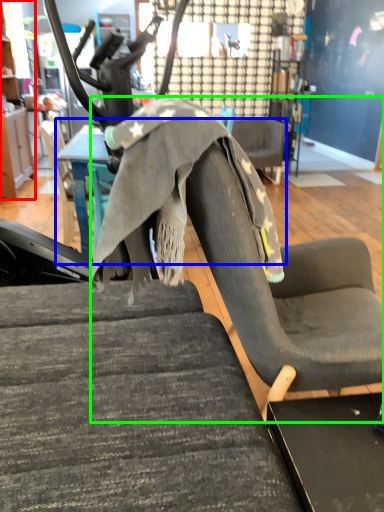
Question: Which is nearer to the cabinetry (highlighted by a red box)? table (highlighted by a blue box) or swivel chair (highlighted by a green box).

Choices:
 (A) table
 (B) swivel chair

Answer: (A)